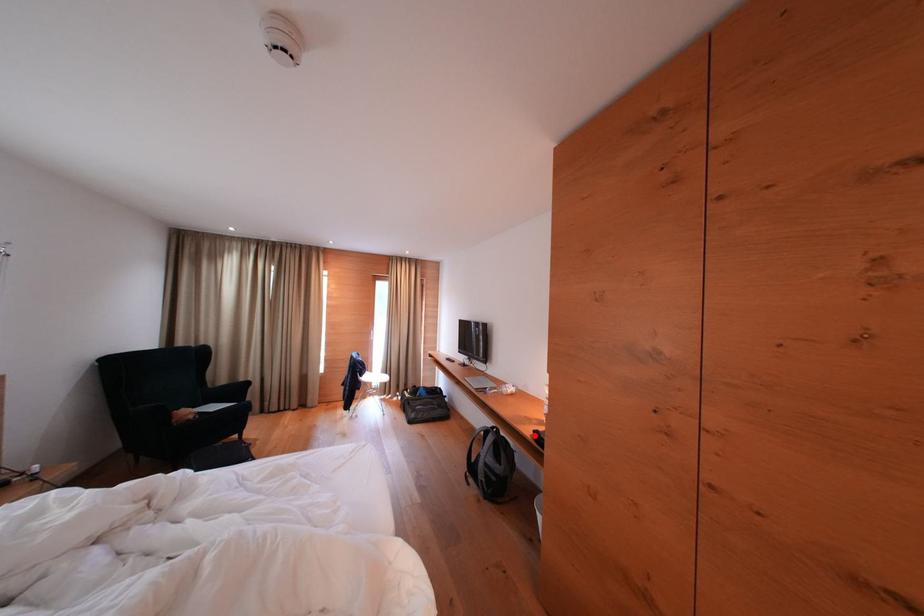
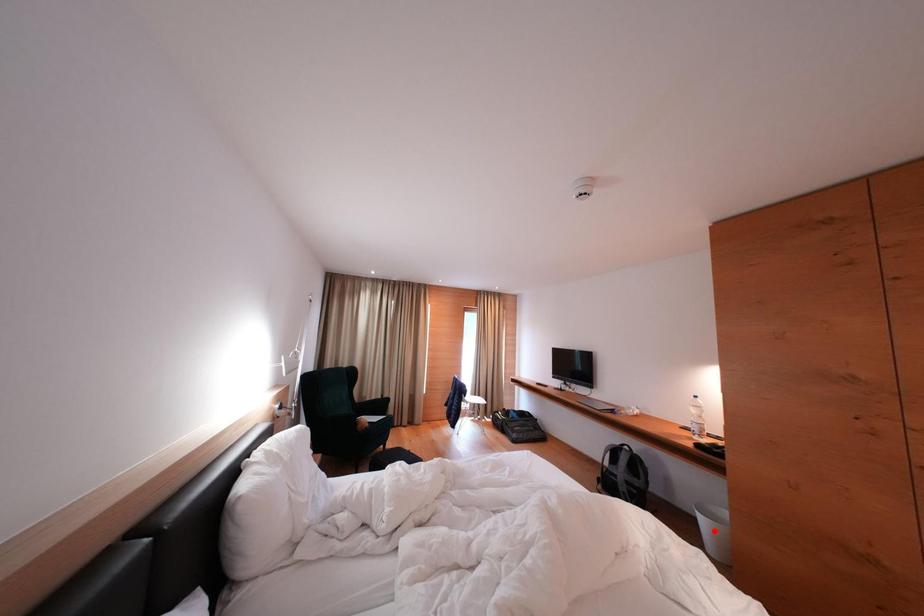
I am providing you with two images of the same scene from different viewpoints. A red point is marked on the first image and another point is marked on the second image. Is the marked point in image1 the same physical position as the marked point in image2?

No